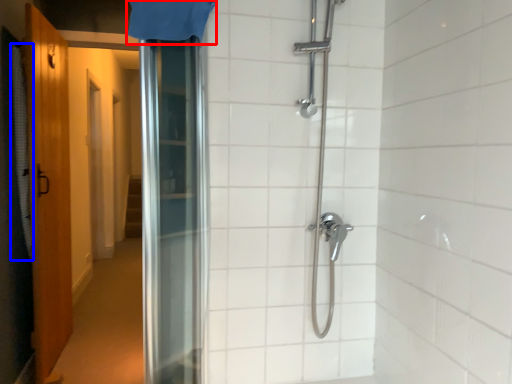
Question: Among these objects, which one is nearest to the camera, shower curtain (highlighted by a red box) or shower curtain (highlighted by a blue box)?

Choices:
 (A) shower curtain
 (B) shower curtain

Answer: (A)